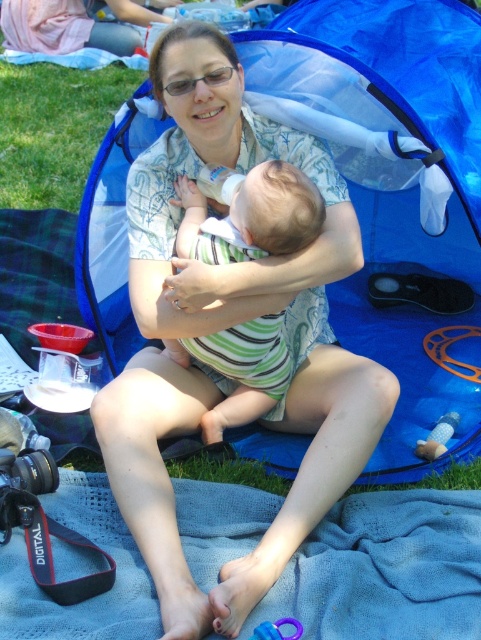
Question: Does matte white shirt at center appear over green striped onesie at center?

Choices:
 (A) yes
 (B) no

Answer: (B)

Question: Does matte white shirt at center have a lesser width compared to green striped onesie at center?

Choices:
 (A) yes
 (B) no

Answer: (B)

Question: Among these objects, which one is nearest to the camera?

Choices:
 (A) blue fabric blanket at lower center
 (B) green striped onesie at center

Answer: (A)

Question: Does matte white shirt at center have a greater width compared to blue fabric blanket at lower center?

Choices:
 (A) no
 (B) yes

Answer: (A)

Question: Which object is closer to the camera taking this photo?

Choices:
 (A) matte white shirt at center
 (B) green striped onesie at center
 (C) blue fabric blanket at lower center

Answer: (C)

Question: Estimate the real-world distances between objects in this image. Which object is closer to the blue fabric blanket at lower center?

Choices:
 (A) matte white shirt at center
 (B) green striped onesie at center

Answer: (A)